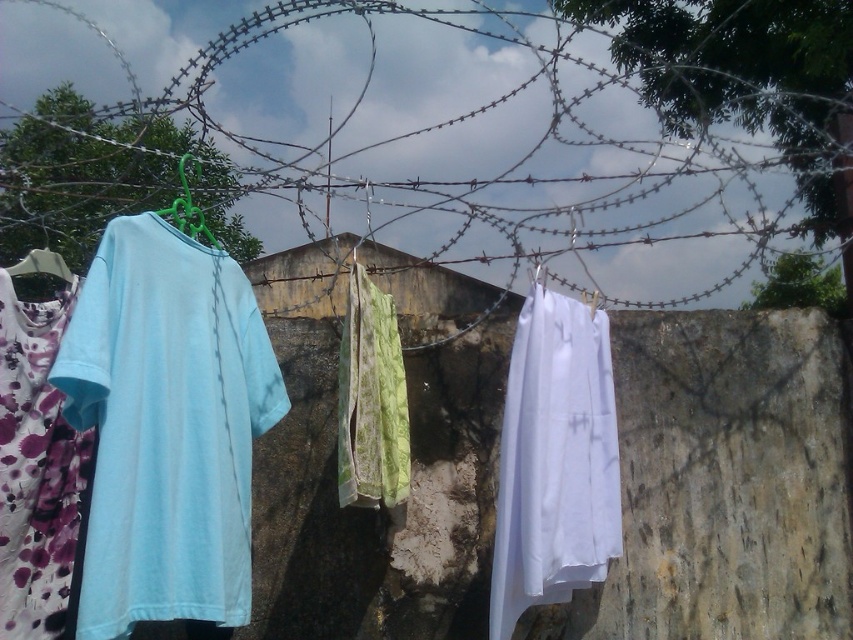
Question: Which point appears closest to the camera in this image?

Choices:
 (A) pyautogui.click(x=238, y=392)
 (B) pyautogui.click(x=578, y=552)
 (C) pyautogui.click(x=32, y=301)
 (D) pyautogui.click(x=345, y=337)

Answer: (A)

Question: Which point is farther from the camera taking this photo?

Choices:
 (A) (134, 552)
 (B) (619, 44)

Answer: (B)

Question: Does rusty wire at center appear under green textured fabric at center?

Choices:
 (A) no
 (B) yes

Answer: (A)

Question: Is light blue cotton t-shirt at left smaller than matte plastic hanger at left?

Choices:
 (A) no
 (B) yes

Answer: (A)

Question: Observing the image, what is the correct spatial positioning of rusty wire at center in reference to floral cotton dress at left?

Choices:
 (A) left
 (B) right

Answer: (B)

Question: Among these points, which one is nearest to the camera?

Choices:
 (A) (196, 218)
 (B) (154, 93)
 (C) (3, 609)

Answer: (C)